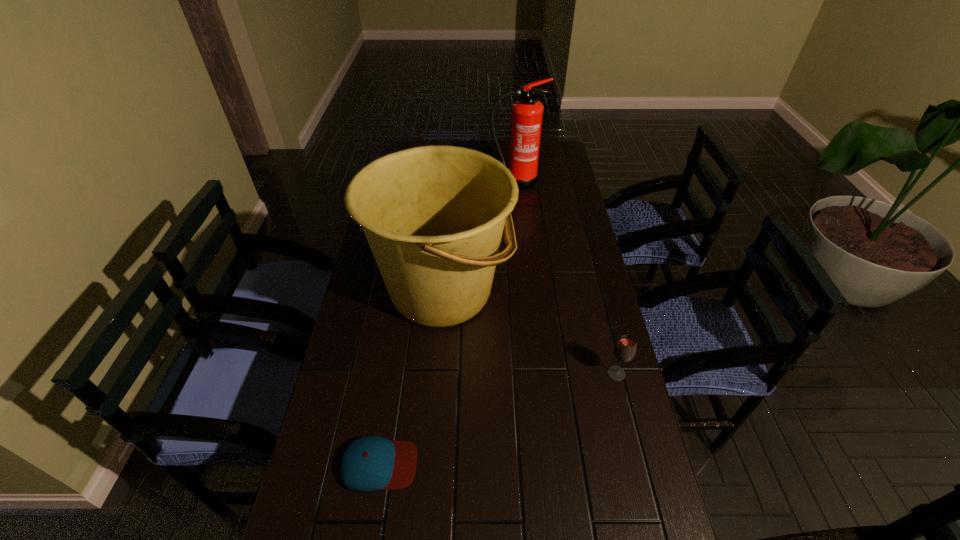
Image resolution: width=960 pixels, height=540 pixels. In order to click on vacant space that satisfies the following two spatial constraints: 1. at the nozzle of the rightmost object; 2. on the right side of the farthest object in this screenshot , I will do [535, 374].